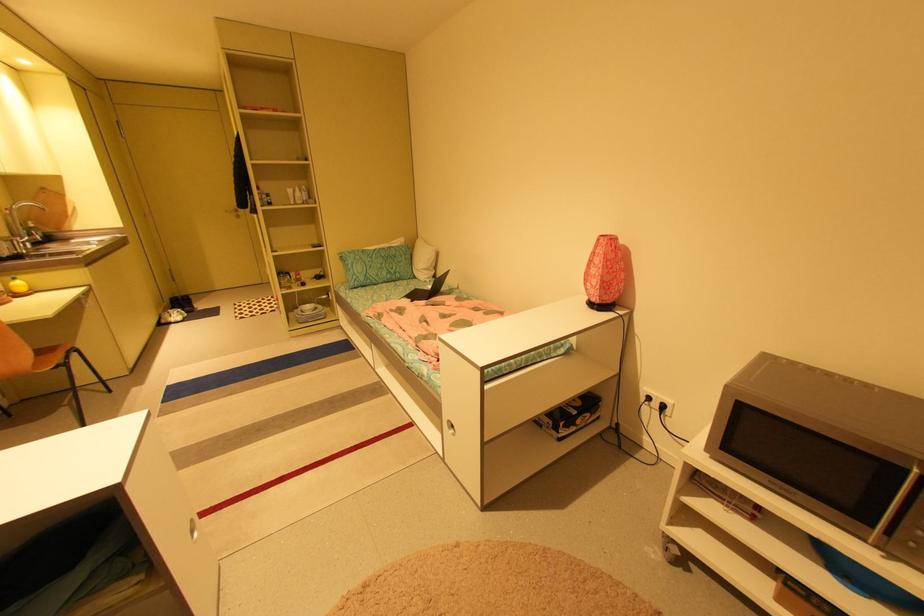
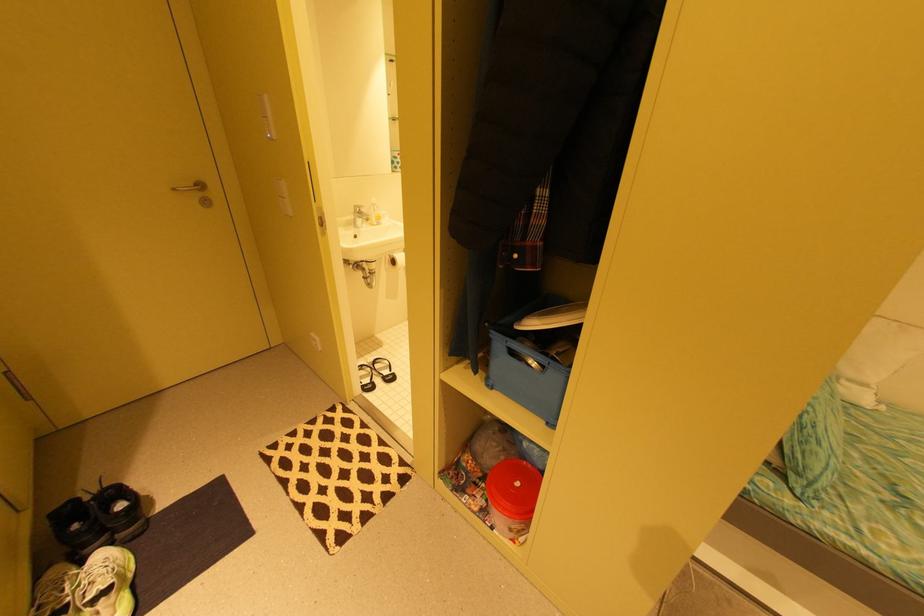
Find the pixel in the second image that matches [232,211] in the first image.

(179, 190)